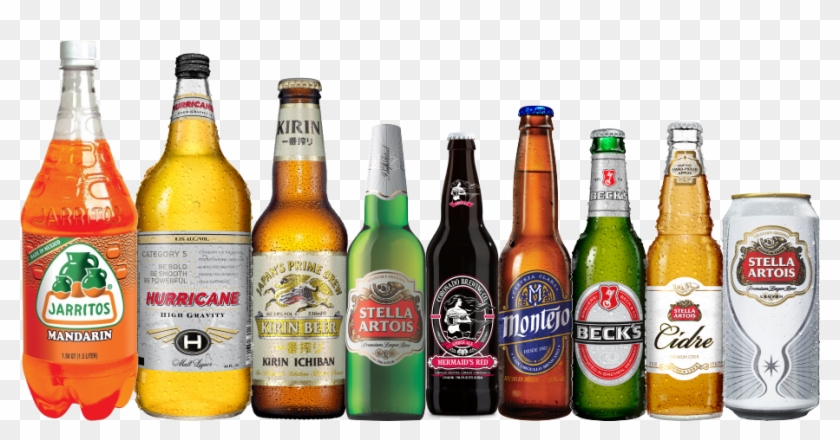
Locate an element on the screen. This screenshot has height=440, width=840. bottle is located at coordinates (79, 193), (179, 191), (311, 223), (387, 256), (459, 250), (532, 260), (607, 256), (689, 249).